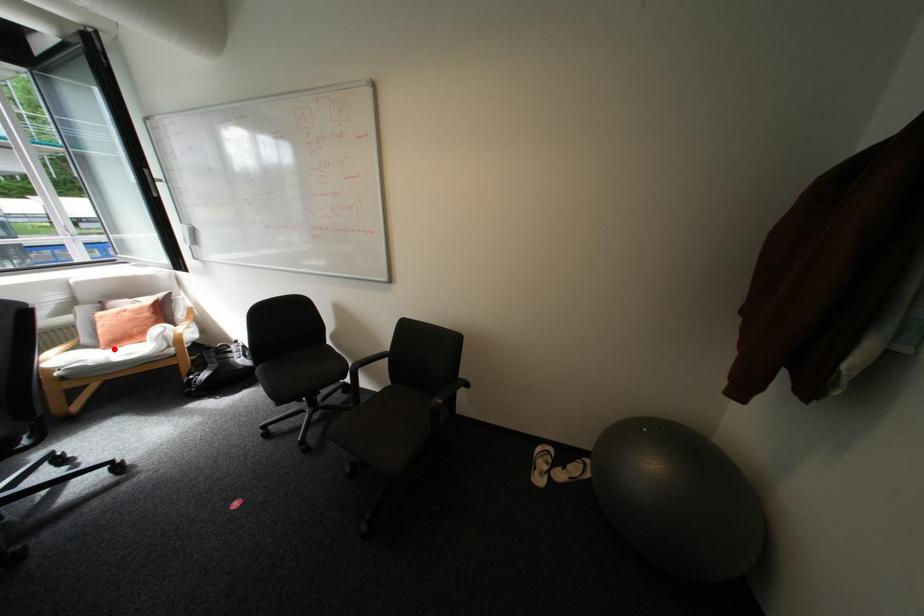
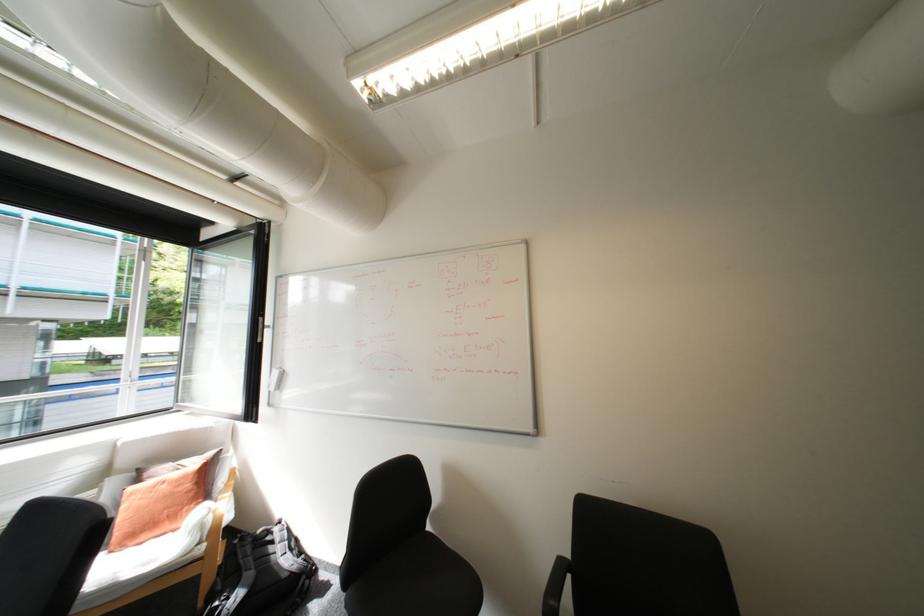
Question: I am providing you with two images of the same scene from different viewpoints. Image1 has a red point marked. In image2, the corresponding 3D location appears at what relative position? Reply with the corresponding letter.

Choices:
 (A) Closer
 (B) Farther

Answer: (B)